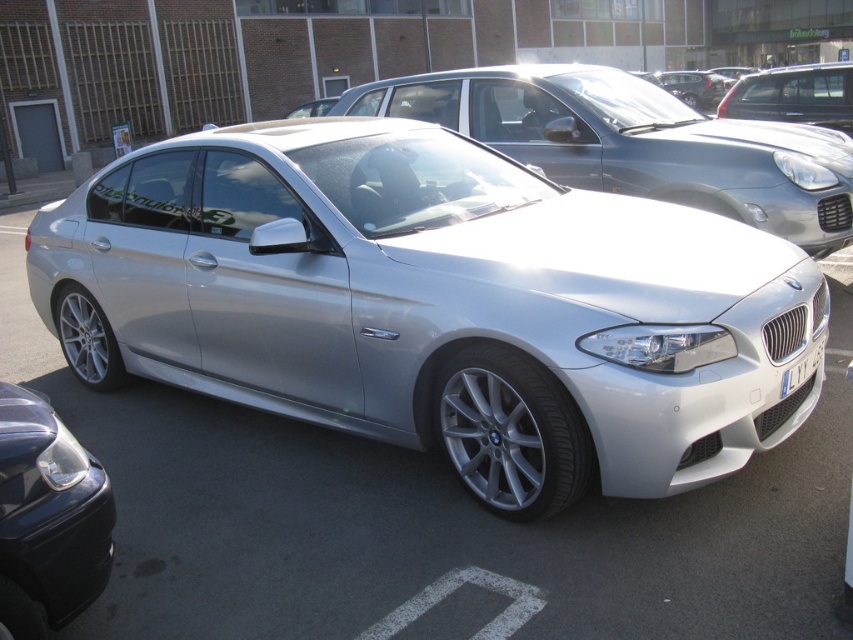
Can you confirm if satin silver car at center is taller than silver metallic car at center?

In fact, satin silver car at center may be shorter than silver metallic car at center.

Which is more to the left, satin silver car at center or silver metallic car at center?

silver metallic car at center

Where is `satin silver car at center`? satin silver car at center is located at coordinates (434, 305).

Is satin silver car at center positioned at the back of white metallic license plate at front?

No, satin silver car at center is in front of white metallic license plate at front.

The image size is (853, 640). What do you see at coordinates (434, 305) in the screenshot? I see `satin silver car at center` at bounding box center [434, 305].

Does point (163, 337) come in front of point (786, 371)?

That is False.

This screenshot has width=853, height=640. Identify the location of satin silver car at center. 434,305.

Is point (61, 484) more distant than point (793, 371)?

No, it is in front of (793, 371).

Does black glossy headlight at lower left appear over white metallic license plate at front?

No, black glossy headlight at lower left is not above white metallic license plate at front.

You are a GUI agent. You are given a task and a screenshot of the screen. Output one action in this format:
    pyautogui.click(x=<x>, y=<y>)
    Task: Click on the black glossy headlight at lower left
    The height and width of the screenshot is (640, 853).
    Given the screenshot: What is the action you would take?
    pyautogui.click(x=48, y=518)